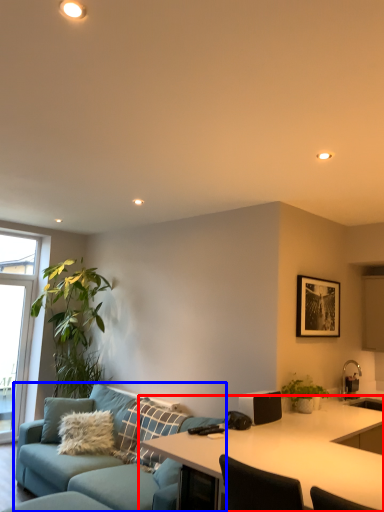
Question: Which of the following is the farthest to the observer, desk (highlighted by a red box) or studio couch (highlighted by a blue box)?

Choices:
 (A) desk
 (B) studio couch

Answer: (B)